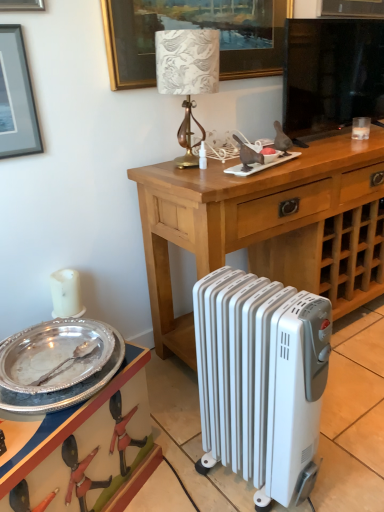
Locate an element on the screen. free space above silver metallic tray at lower left (from a real-world perspective) is located at coordinates (53, 402).